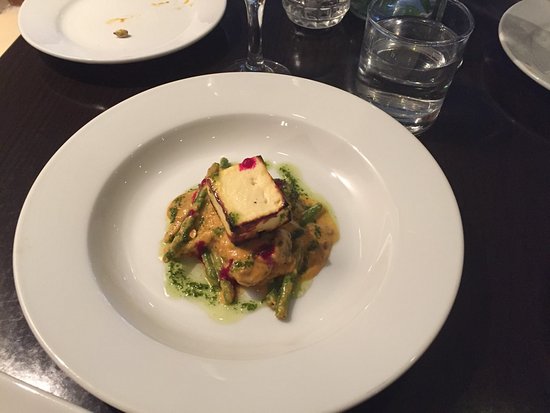
This screenshot has height=413, width=550. In order to click on crumb in this screenshot , I will do `click(118, 32)`.